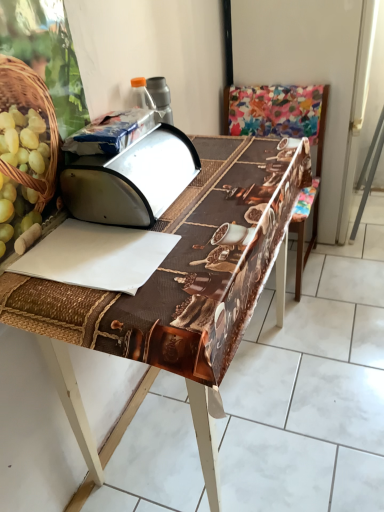
Locate an element on the screen. free spot above white paper at center, the first wrapping paper in the bottom-to-top sequence (from a real-world perspective) is located at coordinates (89, 250).